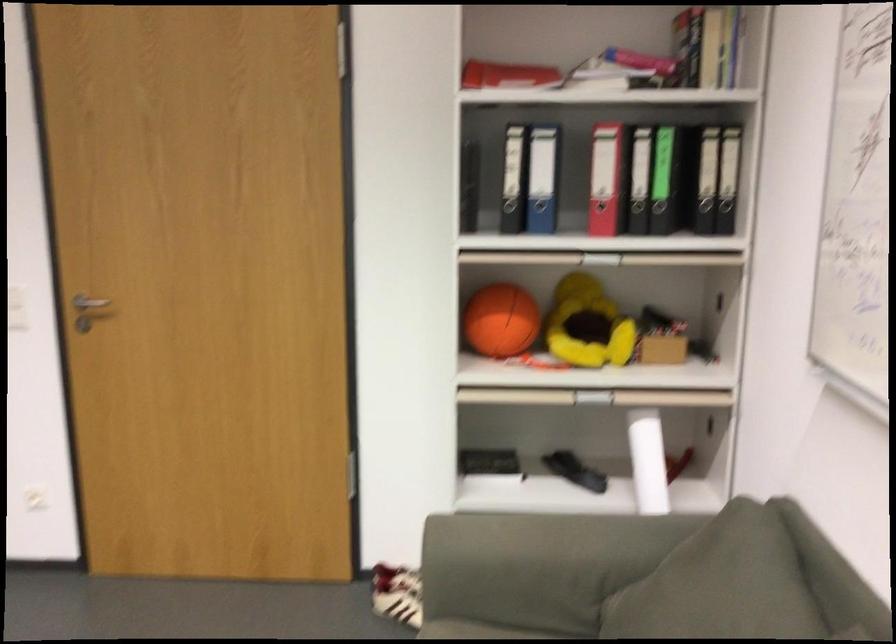
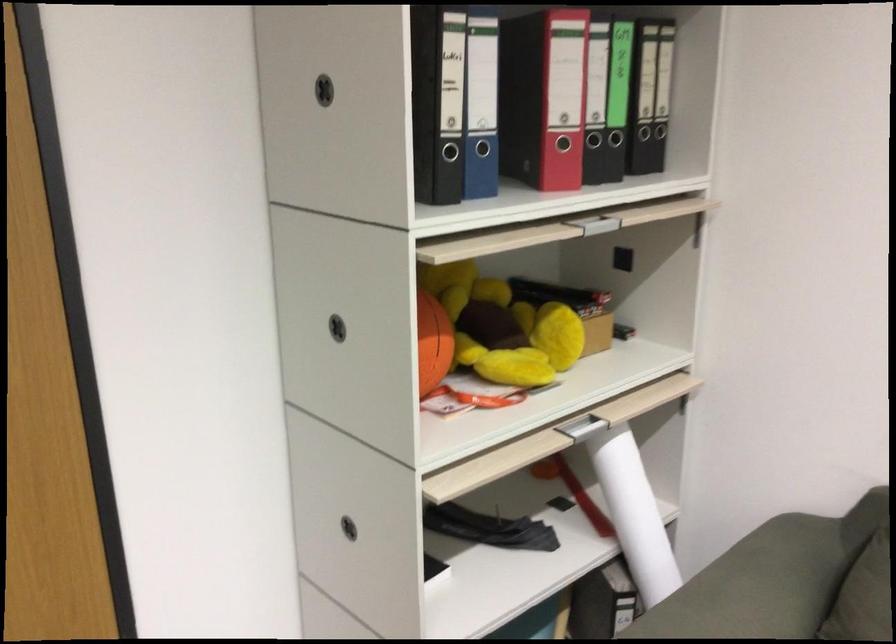
Where in the second image is the point corresponding to (504,317) from the first image?

(433, 343)